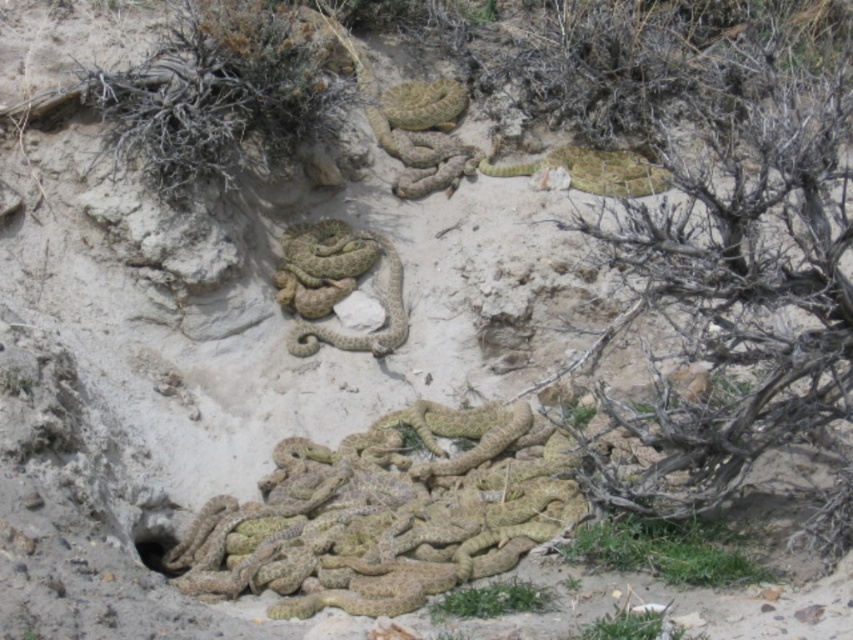
You are a wildlife researcher observing the snakes in the sandy area. You notice two groups of snakes. One group is the camouflage scales snakes at lower center and the other is the camouflage scales snake at center. Which group do you think requires more space to accommodate their size?

The camouflage scales snakes at lower center is bigger than camouflage scales snake at center, so it requires more space to accommodate their size.

You are a hiker trying to navigate through the sandy area in the image. You need to reach a water source located at coordinates 0.805, 0.453. Are the camouflage scales snakes at lower center blocking your path?

The camouflage scales snakes at lower center are located exactly at the coordinates (386, 515), so they are directly at the water source location. Therefore, the snakes are blocking the path to the water source.